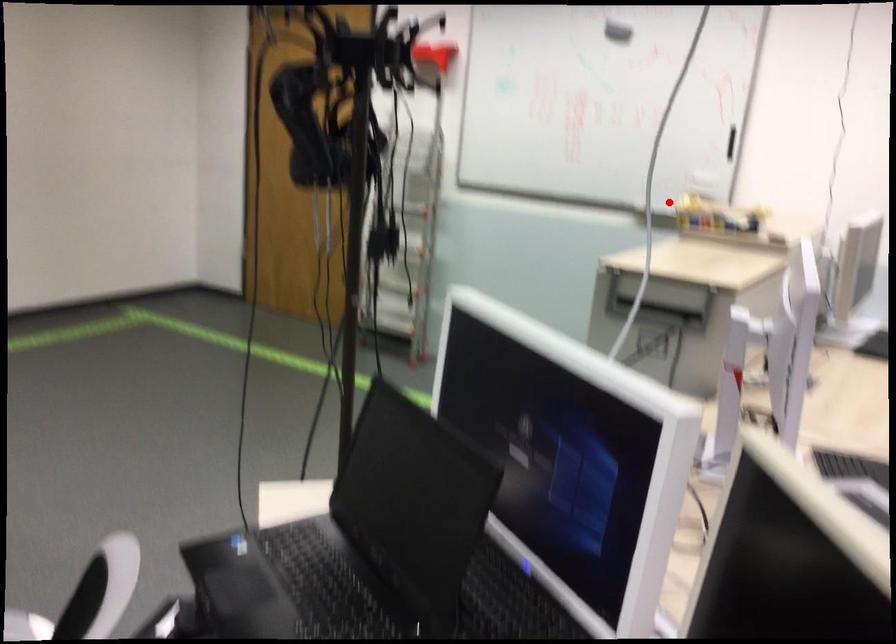
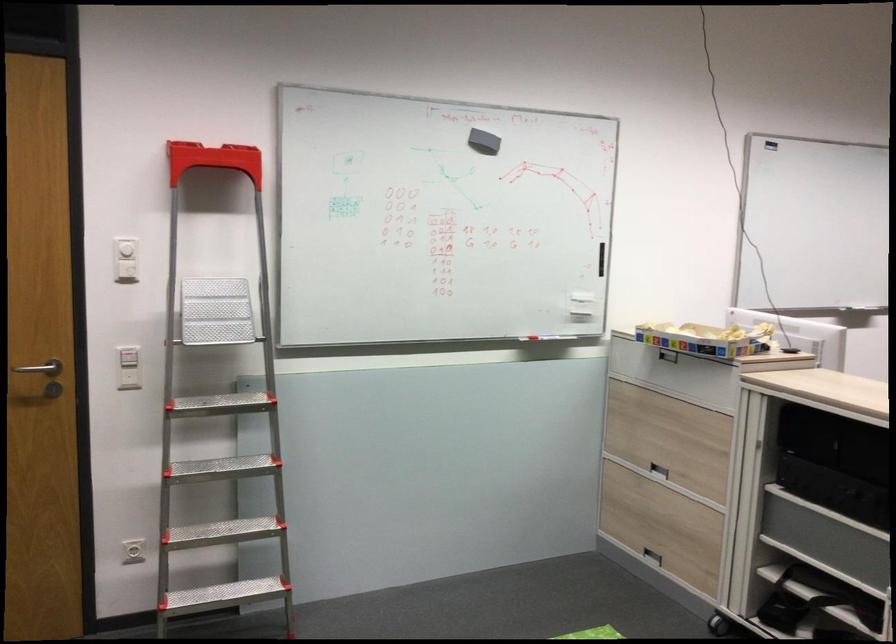
Where in the second image is the point corresponding to the highlighted location from the first image?

(539, 337)